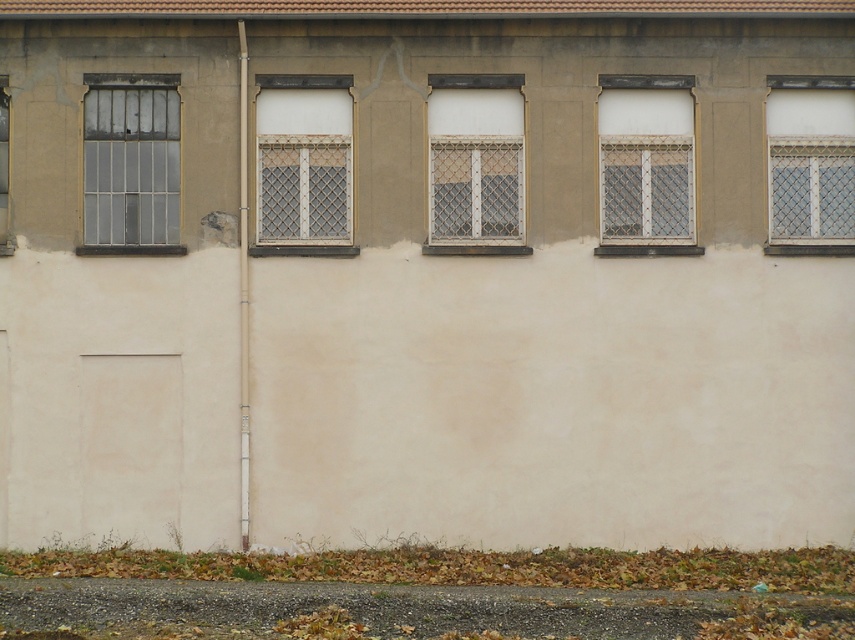
Can you confirm if matte white lattice at center is taller than clear glass window at left?

No, matte white lattice at center is not taller than clear glass window at left.

Does matte white lattice at center have a lesser height compared to clear glass window at left?

Correct, matte white lattice at center is not as tall as clear glass window at left.

Is point (488, 134) positioned before point (4, 246)?

No, it is not.

The image size is (855, 640). I want to click on matte white lattice at center, so click(475, 164).

Is white textured window at center positioned behind white mesh screen at upper right?

No, white textured window at center is closer to the viewer.

Which is behind, point (326, 97) or point (792, 230)?

Positioned behind is point (792, 230).

What do you see at coordinates (304, 164) in the screenshot? The image size is (855, 640). I see `white textured window at center` at bounding box center [304, 164].

This screenshot has height=640, width=855. What are the coordinates of `white textured window at center` in the screenshot? It's located at (304, 164).

Does white textured window at center right have a larger size compared to white mesh screen at upper right?

Yes.

Which of these two, white textured window at center right or white mesh screen at upper right, stands taller?

Standing taller between the two is white textured window at center right.

Which is behind, point (674, 179) or point (817, 198)?

Positioned behind is point (817, 198).

Find the location of a particular element. This screenshot has width=855, height=640. white textured window at center right is located at coordinates (646, 164).